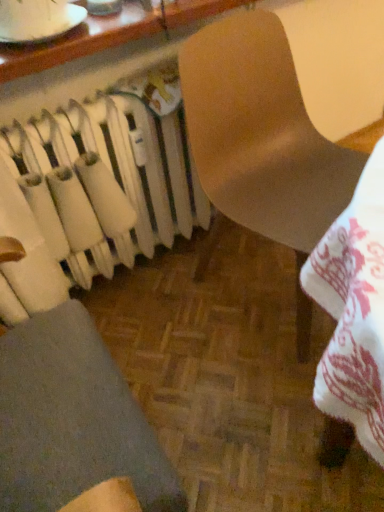
Question: Is white matte radiator at left wider or thinner than matte wooden table at upper center?

Choices:
 (A) thin
 (B) wide

Answer: (A)

Question: Looking at the image, does white matte radiator at left seem bigger or smaller compared to matte wooden table at upper center?

Choices:
 (A) small
 (B) big

Answer: (B)

Question: Which is farther from the matte wooden table at upper center?

Choices:
 (A) matte brown chair at center
 (B) white matte radiator at left

Answer: (B)

Question: Which object is positioned farthest from the matte brown chair at center?

Choices:
 (A) matte wooden table at upper center
 (B) white matte radiator at left

Answer: (A)